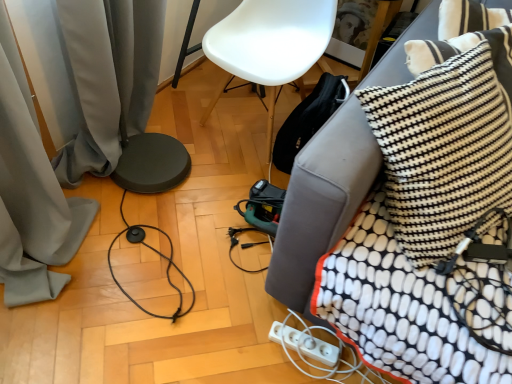
The width and height of the screenshot is (512, 384). Find the location of `blank area to the left of white plastic extension cord at lower right`. blank area to the left of white plastic extension cord at lower right is located at coordinates (230, 336).